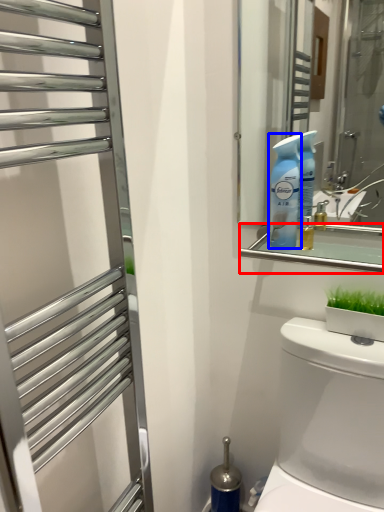
Question: Among these objects, which one is farthest to the camera, balustrade (highlighted by a red box) or cleaning product (highlighted by a blue box)?

Choices:
 (A) balustrade
 (B) cleaning product

Answer: (B)